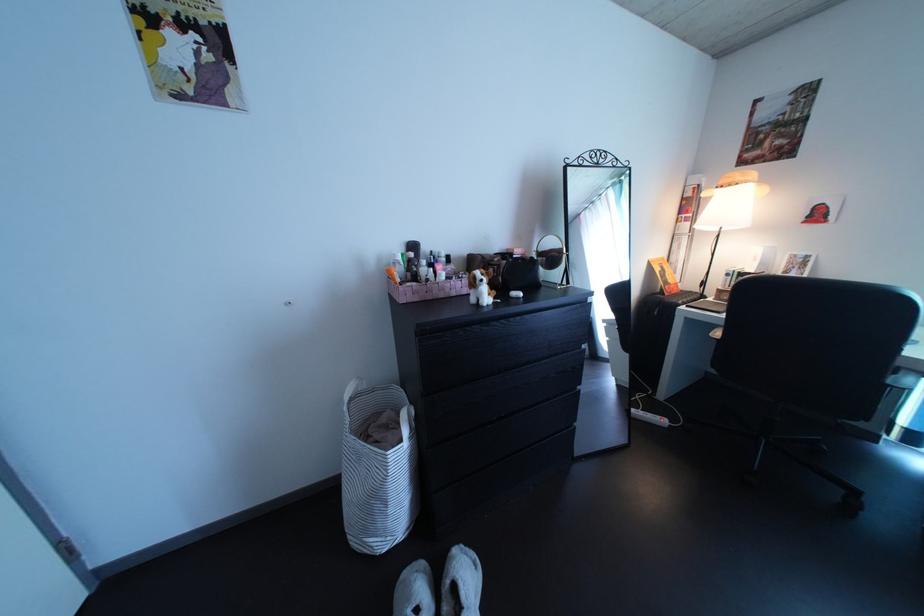
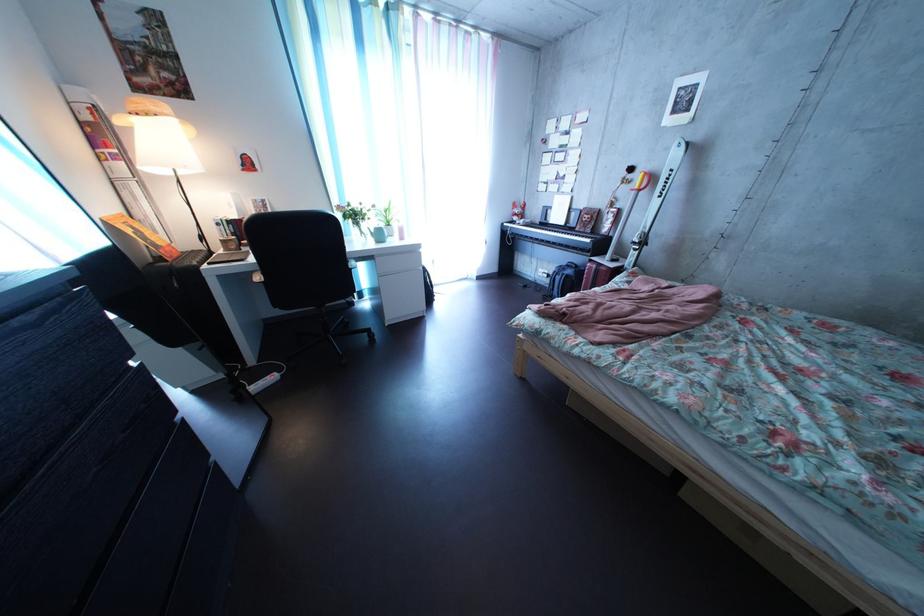
Where in the second image is the point corresponding to point (672, 278) from the first image?

(142, 238)